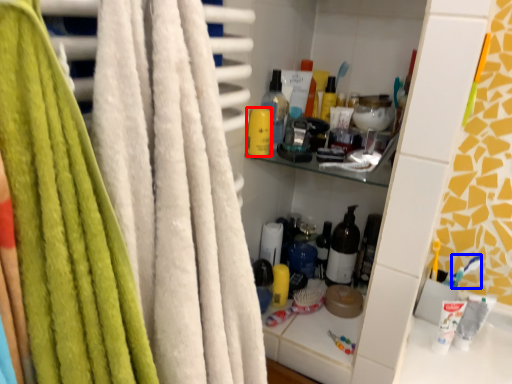
Question: Which object appears farthest to the camera in this image, toiletry (highlighted by a red box) or toothbrush (highlighted by a blue box)?

Choices:
 (A) toiletry
 (B) toothbrush

Answer: (B)